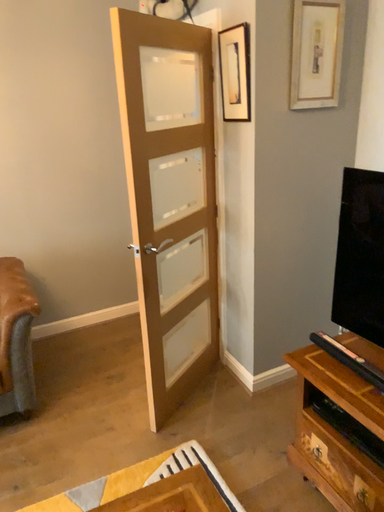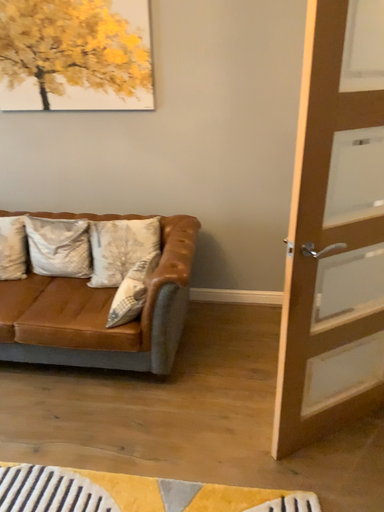
Question: How did the camera likely rotate when shooting the video?

Choices:
 (A) rotated right
 (B) rotated left

Answer: (B)